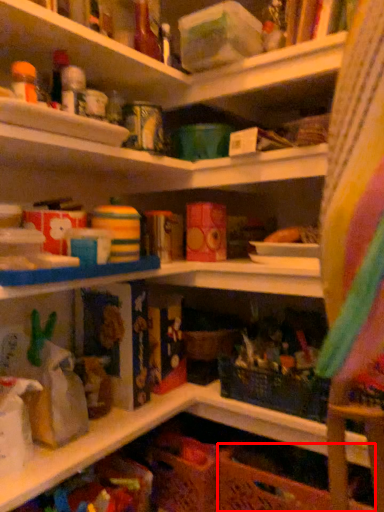
Question: In this image, where is basket (annotated by the red box) located relative to shelf?

Choices:
 (A) right
 (B) left

Answer: (A)